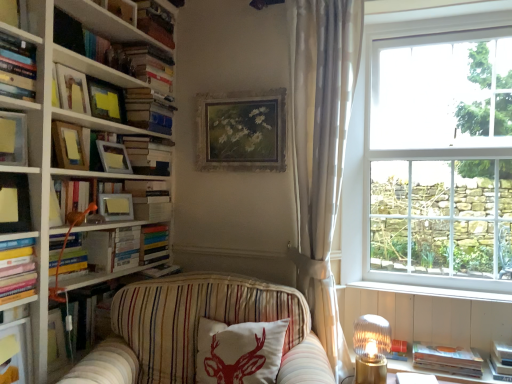
Question: Is matte white shelf at lower left far from white sheer curtain at right?

Choices:
 (A) yes
 (B) no

Answer: (A)

Question: Can you confirm if matte white shelf at lower left is thinner than white sheer curtain at right?

Choices:
 (A) no
 (B) yes

Answer: (B)

Question: From a real-world perspective, is matte white shelf at lower left positioned under white sheer curtain at right based on gravity?

Choices:
 (A) no
 (B) yes

Answer: (B)

Question: Is matte white shelf at lower left closer to the viewer compared to white sheer curtain at right?

Choices:
 (A) yes
 (B) no

Answer: (A)

Question: Considering the relative positions of matte white shelf at lower left and white sheer curtain at right in the image provided, is matte white shelf at lower left to the left of white sheer curtain at right from the viewer's perspective?

Choices:
 (A) no
 (B) yes

Answer: (B)

Question: From a real-world perspective, is hardcover books at upper left, which ranks as the 5th book in top-to-bottom order, physically located above or below matte wooden picture frame at upper left, placed as the 6th picture frame when sorted from right to left?

Choices:
 (A) above
 (B) below

Answer: (B)

Question: Is hardcover books at upper left, which is the ninth book in bottom-to-top order, inside or outside of matte wooden picture frame at upper left, which ranks as the first picture frame in left-to-right order?

Choices:
 (A) outside
 (B) inside

Answer: (A)

Question: Does point (143, 168) appear closer or farther from the camera than point (67, 94)?

Choices:
 (A) farther
 (B) closer

Answer: (A)

Question: Based on their sizes in the image, would you say hardcover books at upper left, which is the ninth book in bottom-to-top order, is bigger or smaller than matte wooden picture frame at upper left, which ranks as the first picture frame in left-to-right order?

Choices:
 (A) big
 (B) small

Answer: (A)

Question: Looking at the image, does hardcover books at upper left, which is the ninth book in bottom-to-top order, seem bigger or smaller compared to translucent glass lampshade at lower right, the 2th lamp viewed from the left?

Choices:
 (A) small
 (B) big

Answer: (B)

Question: In terms of width, does hardcover books at upper left, which is the ninth book in bottom-to-top order, look wider or thinner when compared to translucent glass lampshade at lower right, the 2th lamp positioned from the top?

Choices:
 (A) thin
 (B) wide

Answer: (B)

Question: Is hardcover books at upper left, which is the ninth book in bottom-to-top order, taller or shorter than translucent glass lampshade at lower right, which ranks as the first lamp in right-to-left order?

Choices:
 (A) short
 (B) tall

Answer: (A)

Question: In the image, is hardcover books at upper left, which ranks as the 5th book in top-to-bottom order, positioned in front of or behind translucent glass lampshade at lower right, the 2th lamp viewed from the left?

Choices:
 (A) front
 (B) behind

Answer: (B)

Question: Based on their positions, is hardcover books at upper left, which ranks as the 5th book in top-to-bottom order, located to the left or right of orange fabric lamp at left, which is the first lamp in top-to-bottom order?

Choices:
 (A) right
 (B) left

Answer: (A)

Question: From the image's perspective, relative to orange fabric lamp at left, which is the 2th lamp in bottom-to-top order, is hardcover books at upper left, which is the ninth book in bottom-to-top order, above or below?

Choices:
 (A) below
 (B) above

Answer: (B)